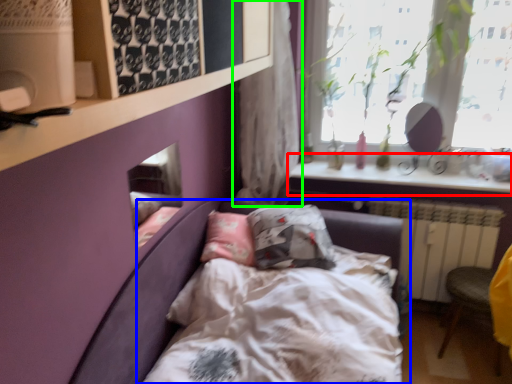
Question: Which object is positioned farthest from window sill (highlighted by a red box)? Select from bed (highlighted by a blue box) and curtain (highlighted by a green box).

Choices:
 (A) bed
 (B) curtain

Answer: (A)